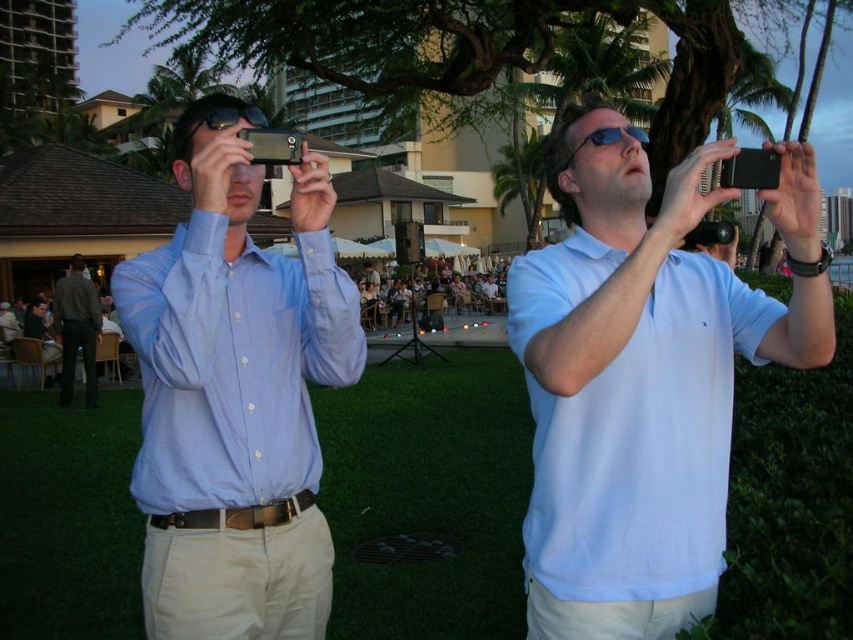
Question: Is light blue cotton polo shirt at upper right wider than light blue button-down shirt at left?

Choices:
 (A) no
 (B) yes

Answer: (B)

Question: Considering the real-world distances, which object is farthest from the light blue button-down shirt at left?

Choices:
 (A) dark gray textured shirt at left
 (B) light blue cotton polo shirt at upper right

Answer: (A)

Question: Does light blue cotton polo shirt at upper right have a larger size compared to light blue button-down shirt at left?

Choices:
 (A) yes
 (B) no

Answer: (A)

Question: Which of the following is the farthest from the observer?

Choices:
 (A) dark gray textured shirt at left
 (B) light blue cotton polo shirt at upper right

Answer: (A)

Question: Which of the following is the farthest from the observer?

Choices:
 (A) dark gray textured shirt at left
 (B) light blue cotton polo shirt at upper right
 (C) light blue button-down shirt at left

Answer: (A)

Question: Is light blue cotton polo shirt at upper right further to camera compared to light blue button-down shirt at left?

Choices:
 (A) no
 (B) yes

Answer: (A)